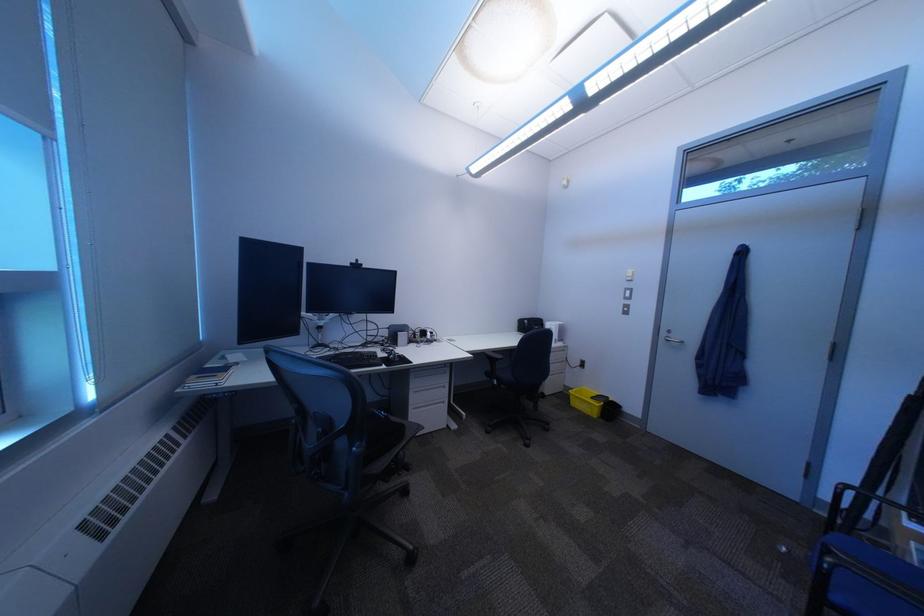
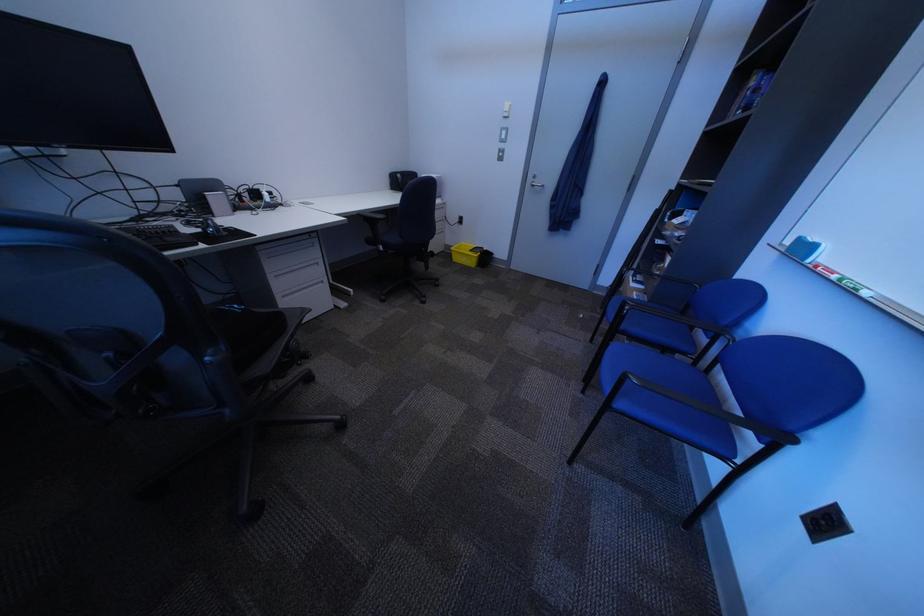
Locate, in the second image, the point that corresponds to (392,414) in the first image.

(238, 310)